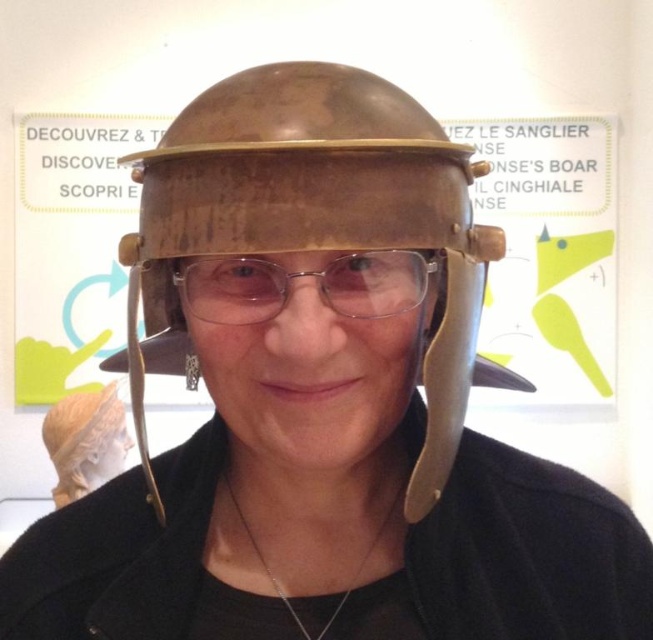
You are a museum curator trying to arrange two helmets in a display case. The rusty metal helmet at center and the matte gold helmet at center must be placed such that they are exactly 1.67 meters apart. Given that the display case is 2 meters wide, can both helmets fit side by side without overlapping?

The distance between the rusty metal helmet at center and the matte gold helmet at center needs to be 1.67 meters. Since the display case is 2 meters wide, there is enough space to place both helmets side by side as 1.67 meters is less than 2 meters, allowing them to fit without overlapping.

What is the spatial relationship between the rusty metal helmet at center and the matte gold helmet at center?

The rusty metal helmet at center is above the matte gold helmet at center.

You are a photographer trying to capture a closeup shot of the rusty metal helmet at center. The camera you are using has a minimum focusing distance of 12 inches. Will you be able to take the photo without moving closer than 12 inches?

The distance of rusty metal helmet at center from camera is 12.30 inches, which is slightly more than the camera minimum focusing distance of 12 inches. Therefore, you can take the photo without moving closer than 12 inches.